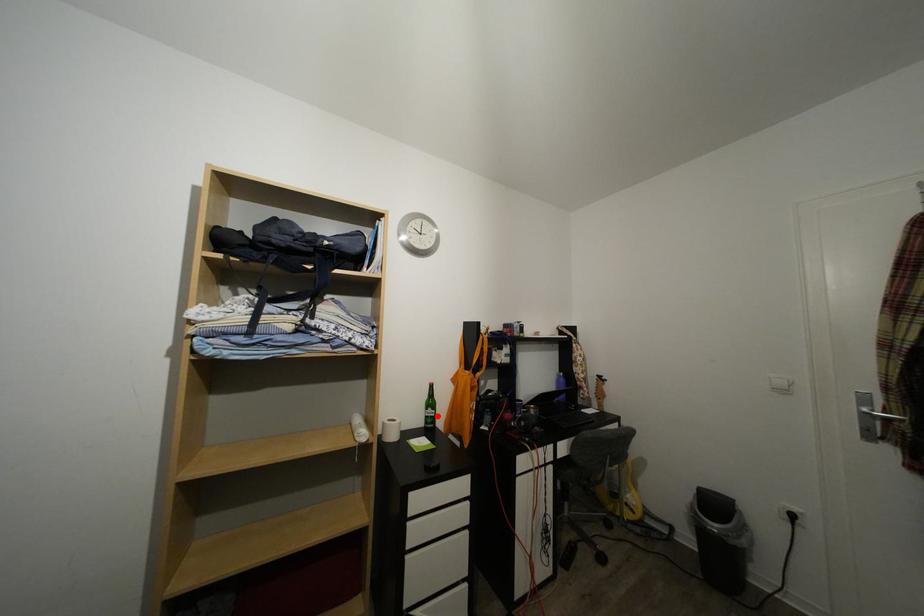
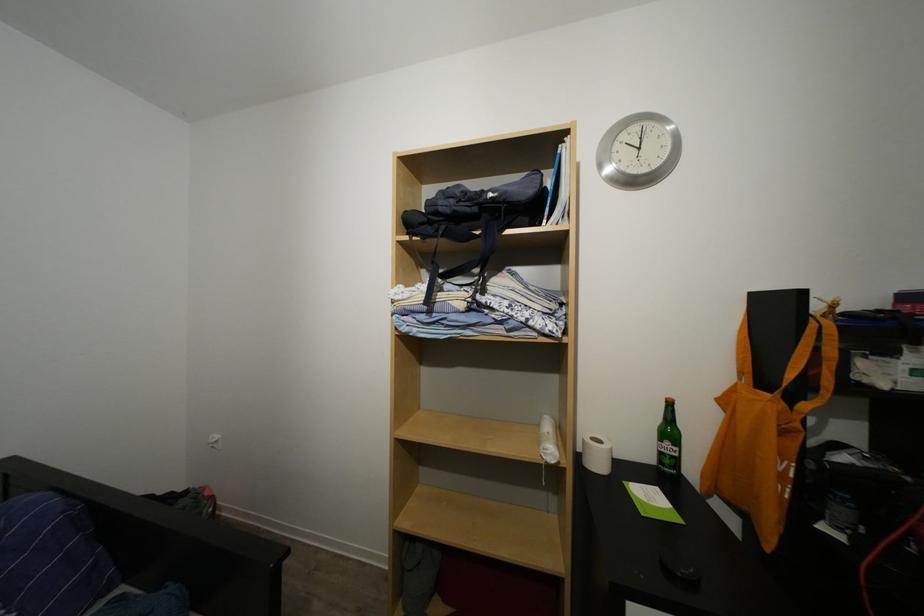
In the second image, find the point that corresponds to the highlighted location in the first image.

(675, 450)